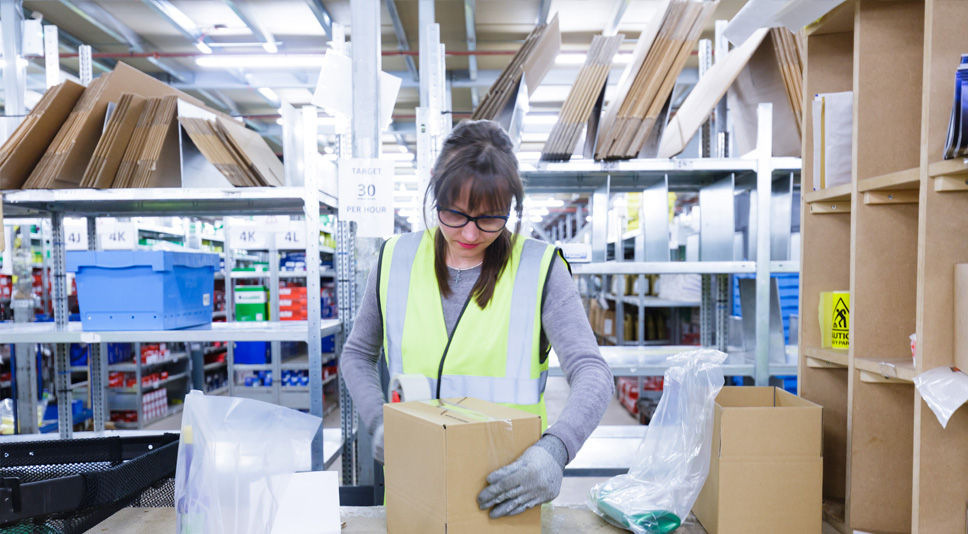
Where is `group of folded cardboard boxes`? The height and width of the screenshot is (534, 968). group of folded cardboard boxes is located at coordinates (505, 76), (578, 87), (648, 96), (787, 70), (19, 128), (72, 129), (106, 140), (144, 151), (221, 158).